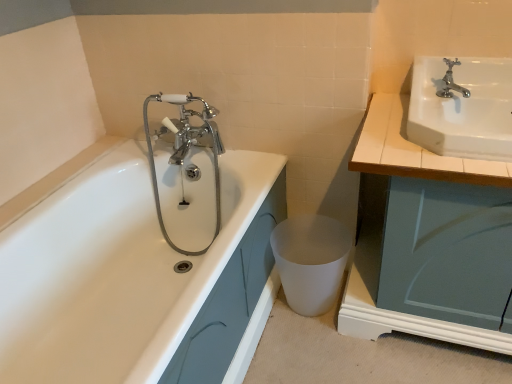
Question: From a real-world perspective, is white matte toilet bowl at lower center located beneath polished chrome faucet at upper right?

Choices:
 (A) yes
 (B) no

Answer: (A)

Question: Is the depth of white matte toilet bowl at lower center less than that of polished chrome faucet at upper right?

Choices:
 (A) yes
 (B) no

Answer: (B)

Question: Is white matte toilet bowl at lower center oriented away from polished chrome faucet at upper right?

Choices:
 (A) no
 (B) yes

Answer: (A)

Question: From a real-world perspective, is white matte toilet bowl at lower center on polished chrome faucet at upper right?

Choices:
 (A) no
 (B) yes

Answer: (A)

Question: Can you confirm if white matte toilet bowl at lower center is bigger than polished chrome faucet at upper right?

Choices:
 (A) yes
 (B) no

Answer: (A)

Question: Can we say white matte toilet bowl at lower center lies outside polished chrome faucet at upper right?

Choices:
 (A) yes
 (B) no

Answer: (A)

Question: Does white glossy sink at upper right come in front of white glossy cabinet at right?

Choices:
 (A) no
 (B) yes

Answer: (A)

Question: From a real-world perspective, is white glossy sink at upper right physically below white glossy cabinet at right?

Choices:
 (A) no
 (B) yes

Answer: (A)

Question: Considering the relative sizes of white glossy sink at upper right and white glossy cabinet at right in the image provided, is white glossy sink at upper right wider than white glossy cabinet at right?

Choices:
 (A) yes
 (B) no

Answer: (B)

Question: From a real-world perspective, is white glossy sink at upper right on white glossy cabinet at right?

Choices:
 (A) yes
 (B) no

Answer: (A)

Question: Does white glossy sink at upper right have a larger size compared to white glossy cabinet at right?

Choices:
 (A) no
 (B) yes

Answer: (A)

Question: Can you confirm if white glossy sink at upper right is shorter than white glossy cabinet at right?

Choices:
 (A) no
 (B) yes

Answer: (B)

Question: Is white glossy sink at upper right not close to polished chrome faucet at upper right?

Choices:
 (A) yes
 (B) no

Answer: (B)